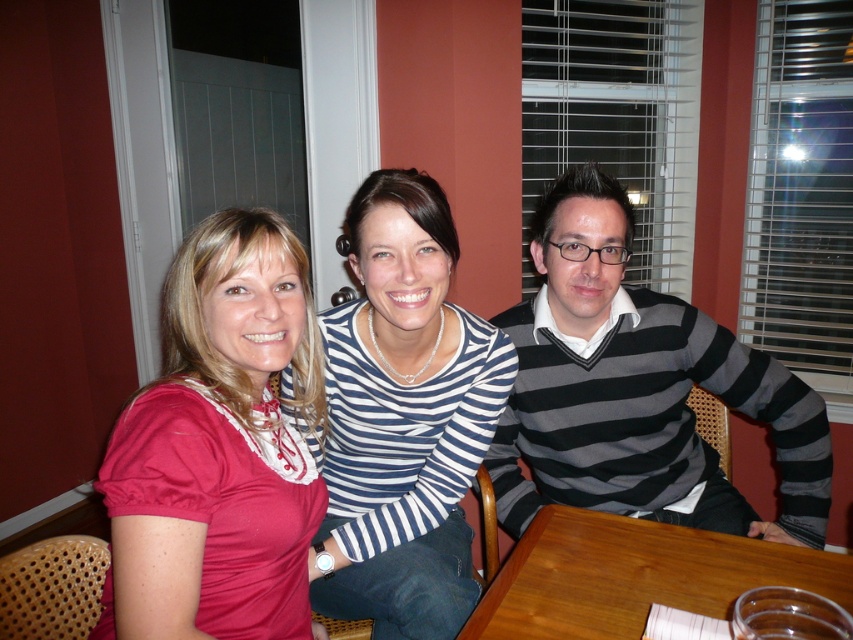
Based on the scene description, where is the striped sweater at center located in terms of coordinates?

The striped sweater at center is located at coordinates point [637,388].

You are standing in front of the dining table where three people are seated. The person on the left is wearing a red top, the one in the center has a navy blue and white striped sweater, and the man on the right has short spiky hair. If you want to place a gift card exactly at the location marked by the coordinates point (637, 388), which person should you hand it to?

The striped sweater at center is located at point (637, 388), so you should hand the gift card to the person in the center wearing the navy blue and white striped sweater.

You are a photographer setting up for a group photo. You have a camera with a 120cm focal length lens. The camera is positioned such that the striped sweater at center and wooden table at center are both in frame. Considering their sizes, which object will appear larger in the final photo?

The striped sweater at center will appear larger in the final photo because it is bigger than the wooden table at center.